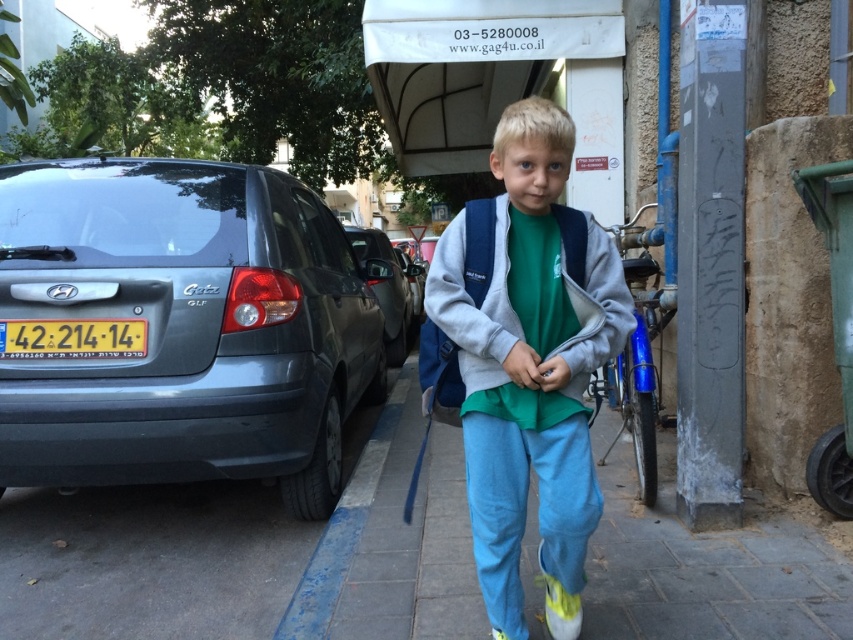
Question: Estimate the real-world distances between objects in this image. Which object is closer to the yellow plastic license plate at lower left?

Choices:
 (A) matte gray car at left
 (B) matte black car at center

Answer: (A)

Question: Considering the real-world distances, which object is closest to the yellow plastic license plate at lower left?

Choices:
 (A) matte gray car at left
 (B) matte black car at center
 (C) yellow synthetic shoe at lower center
 (D) matte gray sweatshirt at center

Answer: (A)

Question: Which of the following is the closest to the observer?

Choices:
 (A) (122, 344)
 (B) (561, 248)

Answer: (B)

Question: Can you confirm if matte gray car at left is positioned to the left of matte black car at center?

Choices:
 (A) no
 (B) yes

Answer: (B)

Question: From the image, what is the correct spatial relationship of matte gray car at left in relation to yellow synthetic shoe at lower center?

Choices:
 (A) above
 (B) below

Answer: (A)

Question: Is matte gray car at left further to the viewer compared to yellow fabric shoe at lower center?

Choices:
 (A) yes
 (B) no

Answer: (A)